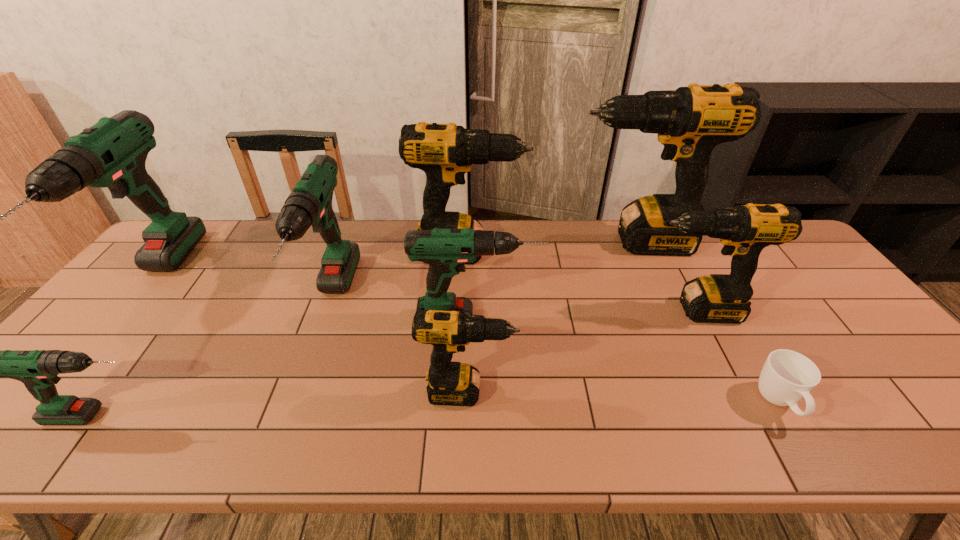
The image size is (960, 540). Find the location of `vacant space positioned 0.260m on the handle side of the rightmost green drill`. vacant space positioned 0.260m on the handle side of the rightmost green drill is located at coordinates (635, 318).

This screenshot has height=540, width=960. I want to click on blank space located 0.280m at the tip of the nearest black drill, so click(x=636, y=392).

Locate an element on the screen. This screenshot has height=540, width=960. vacant space located on the handle side of the shortest drill is located at coordinates (192, 416).

The height and width of the screenshot is (540, 960). In order to click on drill located in the near edge section of the desktop in this screenshot , I will do `click(37, 369)`.

Identify the location of cup at the near edge. This screenshot has height=540, width=960. (787, 376).

The height and width of the screenshot is (540, 960). I want to click on object that is at the far left corner, so click(112, 153).

The width and height of the screenshot is (960, 540). I want to click on object located in the near left corner section of the desktop, so click(x=37, y=369).

The width and height of the screenshot is (960, 540). What are the coordinates of `vacant space at the far edge of the desktop` in the screenshot? It's located at (250, 237).

In the image, there is a desktop. Identify the location of vacant area at the near edge. (117, 450).

Image resolution: width=960 pixels, height=540 pixels. In the image, there is a desktop. Identify the location of free space at the left edge. (133, 282).